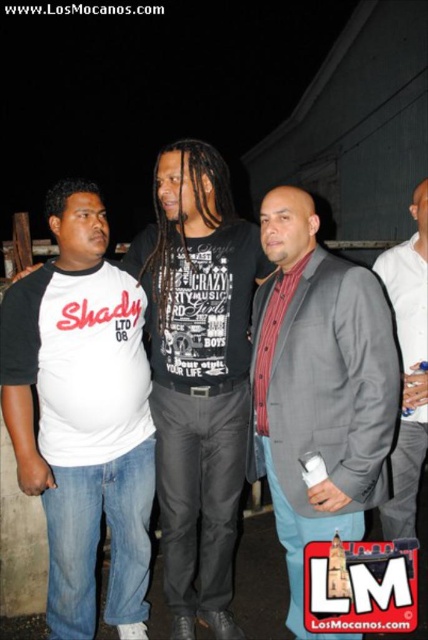
Can you confirm if white cotton t-shirt at left is positioned to the left of gray fabric backpack at right?

Yes, white cotton t-shirt at left is to the left of gray fabric backpack at right.

Does white cotton t-shirt at left have a greater width compared to gray fabric backpack at right?

Correct, the width of white cotton t-shirt at left exceeds that of gray fabric backpack at right.

Does point (228, 545) come farther from viewer compared to point (425, 216)?

No, it is in front of (425, 216).

Find the location of a particular element. Image resolution: width=428 pixels, height=640 pixels. white cotton t-shirt at left is located at coordinates (199, 372).

Can you confirm if white raglan shirt at left is smaller than gray wool blazer at center?

Incorrect, white raglan shirt at left is not smaller in size than gray wool blazer at center.

Where is `white raglan shirt at left`? white raglan shirt at left is located at coordinates (83, 416).

From the picture: Can you confirm if white raglan shirt at left is positioned to the right of white cotton t-shirt at left?

No, white raglan shirt at left is not to the right of white cotton t-shirt at left.

Who is positioned more to the left, white raglan shirt at left or white cotton t-shirt at left?

white raglan shirt at left is more to the left.

Where is `white raglan shirt at left`? The height and width of the screenshot is (640, 428). white raglan shirt at left is located at coordinates (83, 416).

Find the location of a particular element. This screenshot has width=428, height=640. white raglan shirt at left is located at coordinates (83, 416).